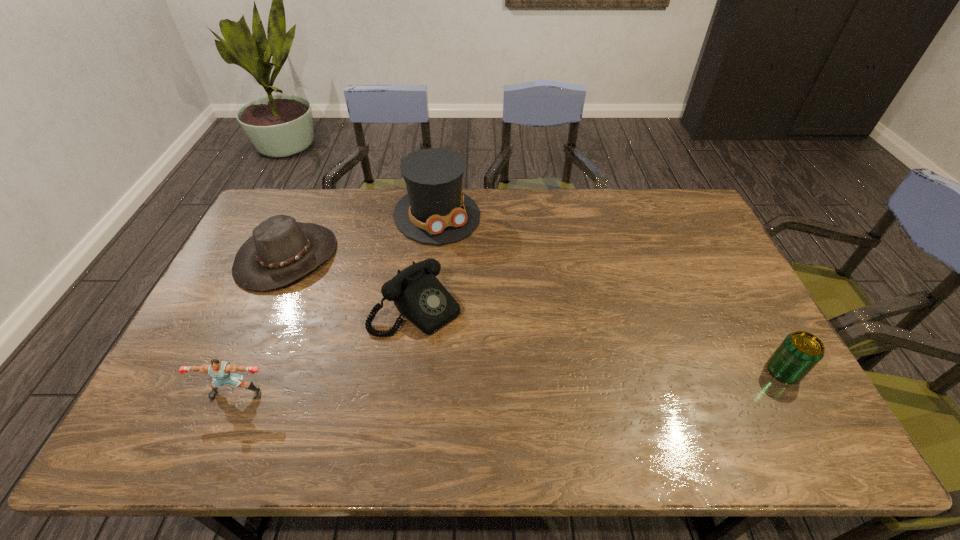
The image size is (960, 540). What are the coordinates of `hat at the left edge` in the screenshot? It's located at pos(281,250).

Locate an element on the screen. This screenshot has width=960, height=540. object that is at the right edge is located at coordinates (799, 352).

Locate an element on the screen. object that is at the far left corner is located at coordinates (281, 250).

Where is `object that is at the near left corner`? object that is at the near left corner is located at coordinates (223, 372).

Locate an element on the screen. The height and width of the screenshot is (540, 960). object at the near right corner is located at coordinates (799, 352).

Identify the location of blank area at the far edge. (636, 204).

In the image, there is a desktop. Where is `vacant area at the near edge`? vacant area at the near edge is located at coordinates (564, 380).

At what (x,y) coordinates should I click in order to perform the action: click on free location at the right edge of the desktop. Please return your answer as a coordinate pair (x, y). Image resolution: width=960 pixels, height=540 pixels. Looking at the image, I should click on click(729, 334).

The width and height of the screenshot is (960, 540). I want to click on free spot between the puncher and the hat, so click(261, 325).

This screenshot has height=540, width=960. In order to click on vacant point located between the dress hat and the hat in this screenshot , I will do `click(362, 235)`.